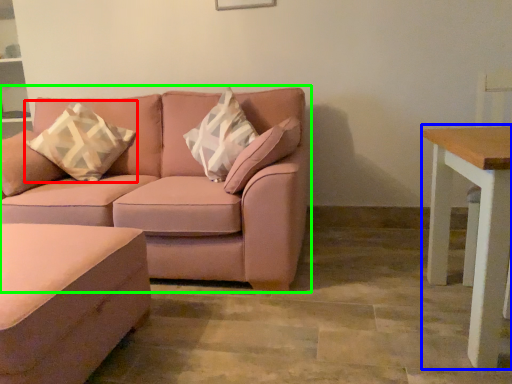
Question: Based on their relative distances, which object is farther from throw pillow (highlighted by a red box)? Choose from table (highlighted by a blue box) and studio couch (highlighted by a green box).

Choices:
 (A) table
 (B) studio couch

Answer: (A)